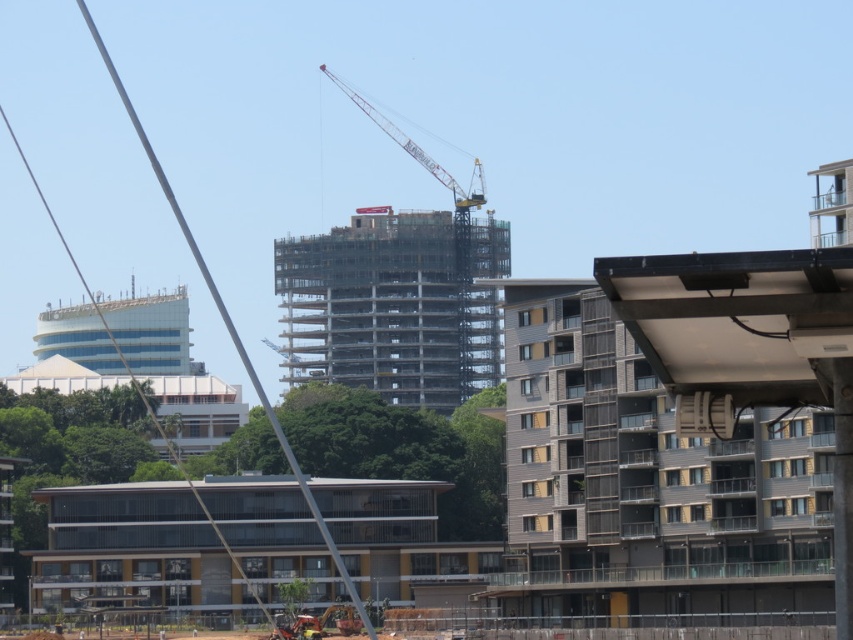
Does point (300, 276) come in front of point (467, 212)?

Yes, it is in front of point (467, 212).

Who is more forward, (386, 400) or (346, 88)?

Point (386, 400)

Where is `metal scaffolding at center`? The height and width of the screenshot is (640, 853). metal scaffolding at center is located at coordinates (393, 305).